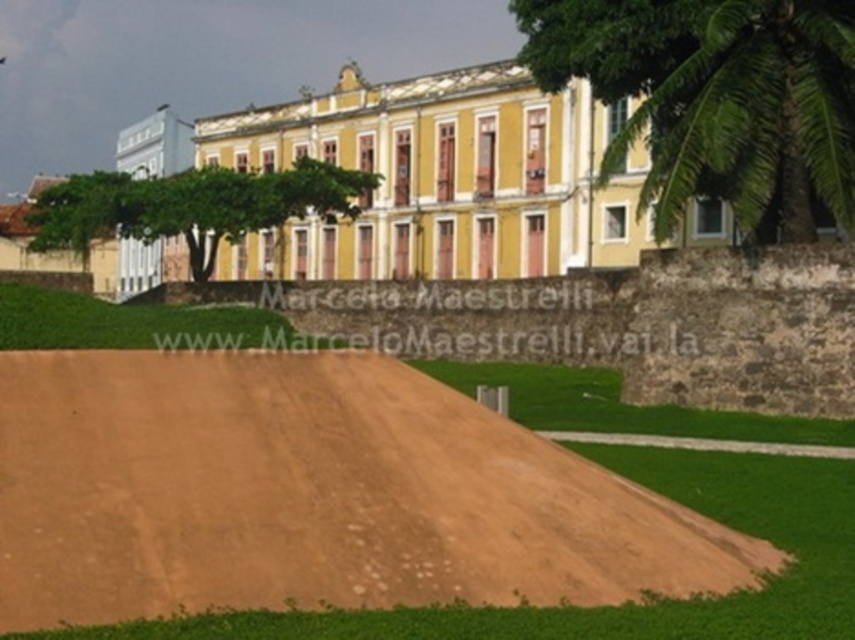
You are a landscape architect planning to add more plants to the area. Considering the space occupied by the brown sandy dirt at center and the green leafy palm tree at upper center, which one would allow for more expansion of plants without moving existing elements?

The green leafy palm tree at upper center occupies more space than the brown sandy dirt at center, so expanding plants around the brown sandy dirt at center would allow more room for new plants without moving existing elements.

You are a landscape architect designing a garden around the yellow colonial building. You notice the brown sandy dirt at center and the green leafy palm tree at upper center. Which object is positioned lower in the scene?

The brown sandy dirt at center is positioned below the green leafy palm tree at upper center, so it is lower in the scene.